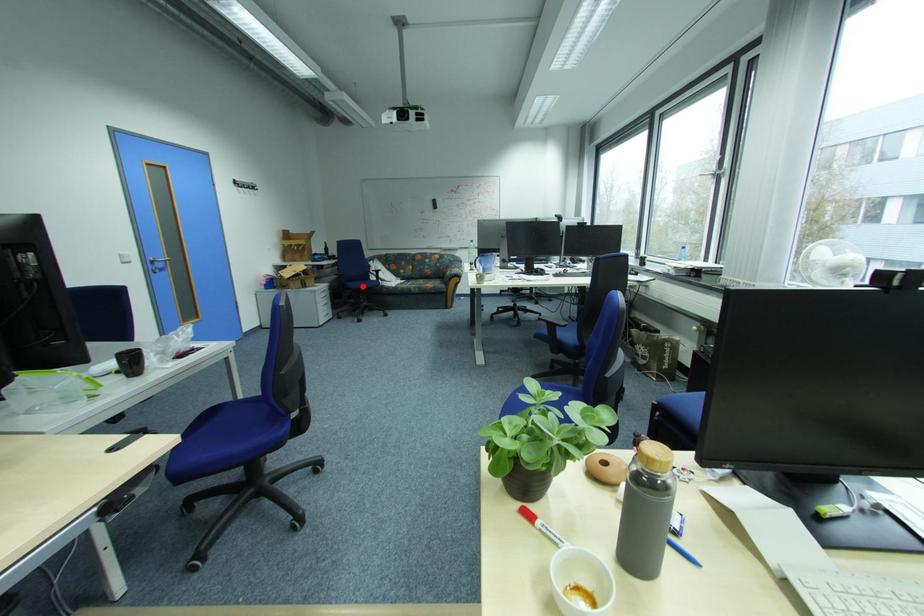
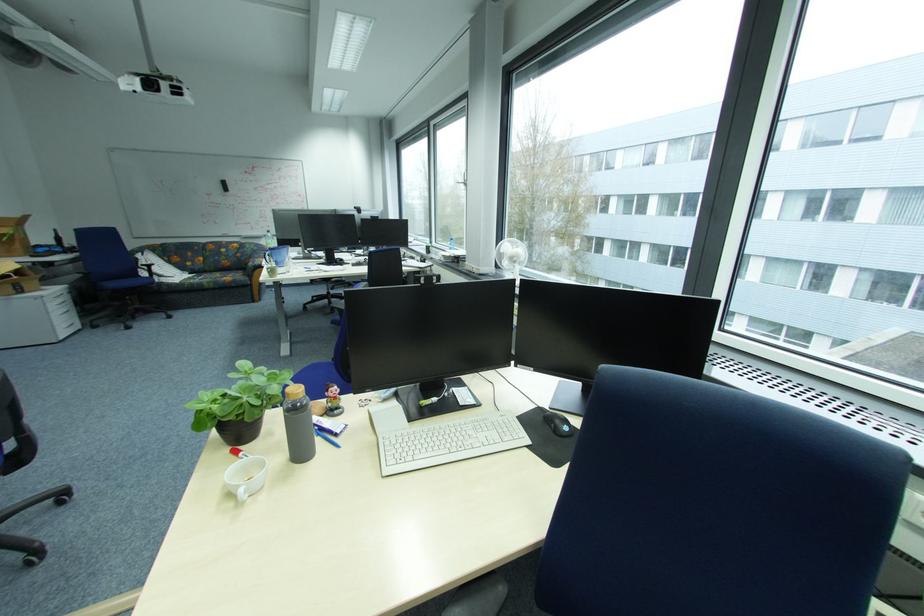
In the second image, find the point that corresponds to the highlighted location in the first image.

(120, 286)